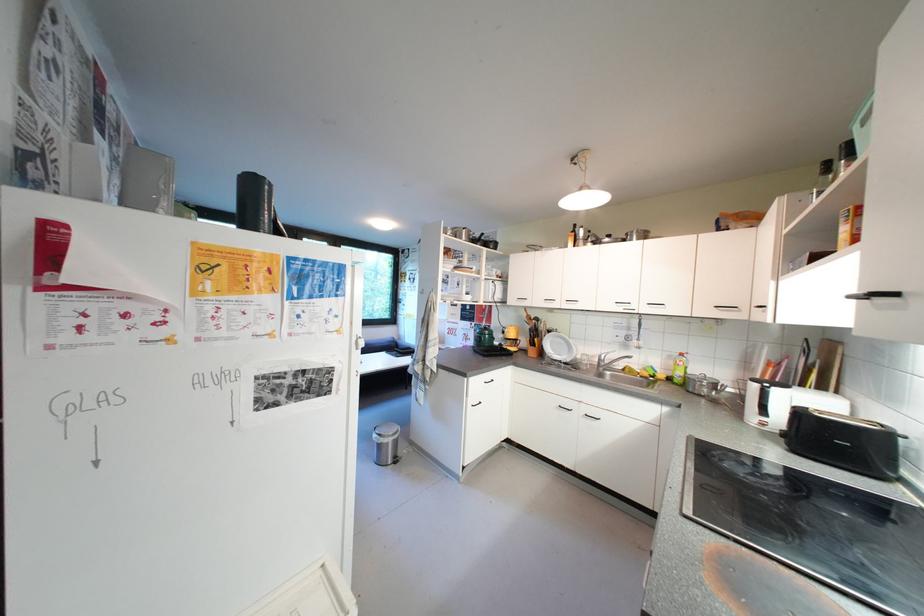
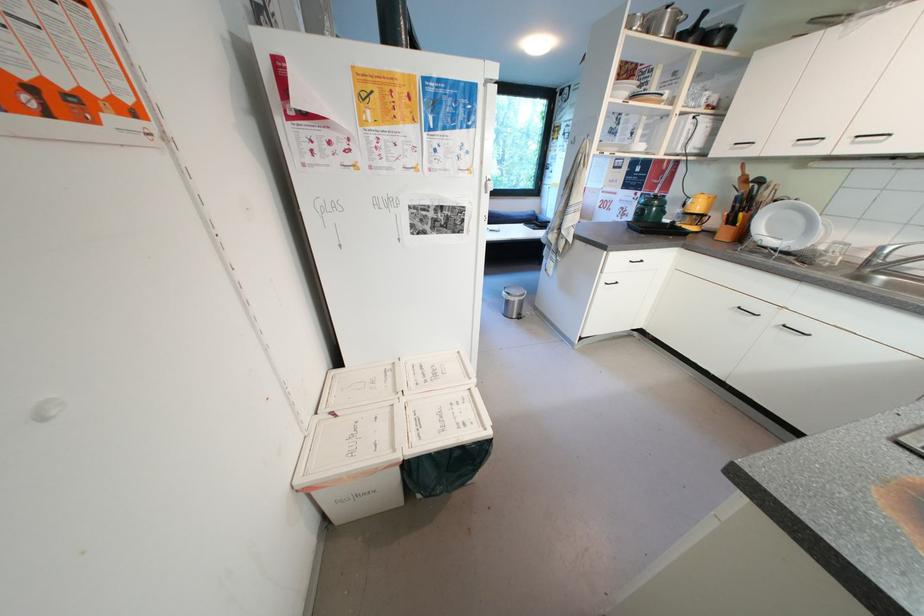
Where in the second image is the point corresponding to the point at 481,326 from the first image?

(647, 196)